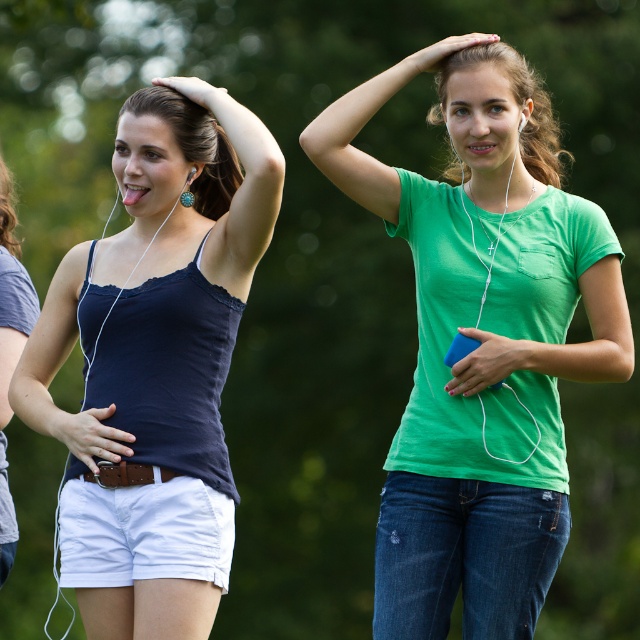
Question: Can you confirm if matte black tank top at left is positioned to the right of white cotton shorts at lower left?

Choices:
 (A) yes
 (B) no

Answer: (A)

Question: Which of the following is the closest to the observer?

Choices:
 (A) (172, 148)
 (B) (144, 532)
 (C) (435, 608)

Answer: (B)

Question: Which of the following is the closest to the observer?

Choices:
 (A) white cotton shorts at lower left
 (B) matte black tank top at left

Answer: (B)

Question: Estimate the real-world distances between objects in this image. Which object is closer to the white cotton shorts at lower left?

Choices:
 (A) green cotton shirt at center
 (B) matte black tank top at left

Answer: (B)

Question: In this image, where is green cotton shirt at center located relative to white cotton shorts at lower left?

Choices:
 (A) left
 (B) right

Answer: (B)

Question: Can you confirm if green cotton shirt at center is smaller than matte black tank top at left?

Choices:
 (A) yes
 (B) no

Answer: (B)